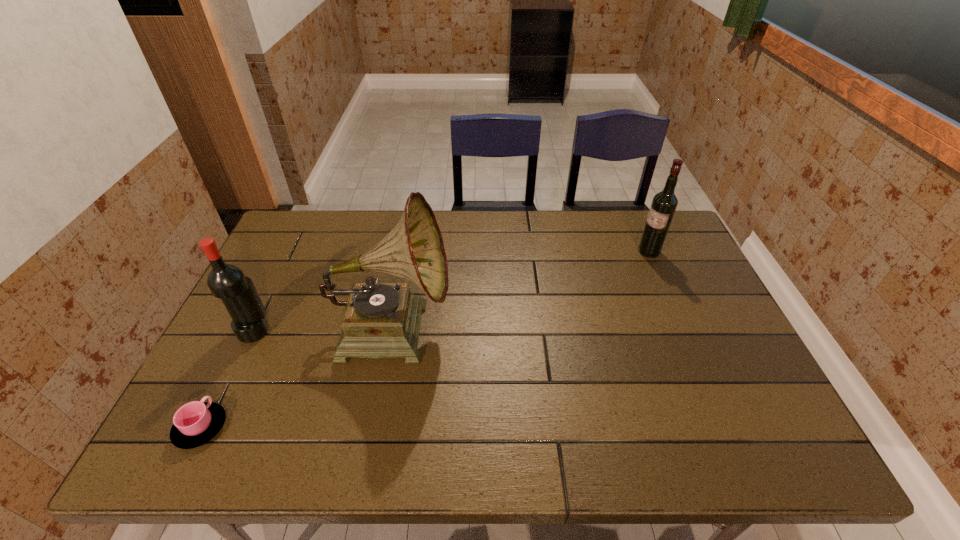
I want to click on free space between the nearest object and the tallest object, so click(297, 377).

Find the location of `vacant space that's between the tallest object and the nearest object`. vacant space that's between the tallest object and the nearest object is located at coordinates (297, 377).

Where is `vacant region between the cup and the left wine bottle`? The image size is (960, 540). vacant region between the cup and the left wine bottle is located at coordinates (228, 379).

At what (x,y) coordinates should I click in order to perform the action: click on empty space that is in between the rightmost object and the record player. Please return your answer as a coordinate pair (x, y). The width and height of the screenshot is (960, 540). Looking at the image, I should click on (520, 289).

Identify the location of blank region between the right wine bottle and the record player. (520, 289).

I want to click on object identified as the third closest to the tallest object, so click(664, 203).

I want to click on object that is the third closest one to the record player, so click(x=664, y=203).

Identify the location of free space that satisfies the following two spatial constraints: 1. on the side with the handle of the nearer wine bottle; 2. on the right side of the shortest object. (250, 330).

The height and width of the screenshot is (540, 960). Identify the location of free spot that satisfies the following two spatial constraints: 1. on the side with the handle of the nearest object; 2. on the right side of the left wine bottle. (250, 330).

Locate an element on the screen. This screenshot has height=540, width=960. free space that satisfies the following two spatial constraints: 1. on the side with the handle of the cup; 2. on the right side of the nearer wine bottle is located at coordinates (250, 330).